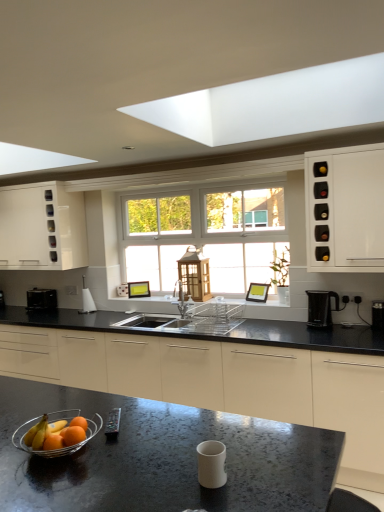
At what (x,y) coordinates should I click in order to perform the action: click on free space in front of metallic remote control at center, which ranks as the 3th appliance in left-to-right order. Please return your answer as a coordinate pair (x, y). Looking at the image, I should click on (119, 447).